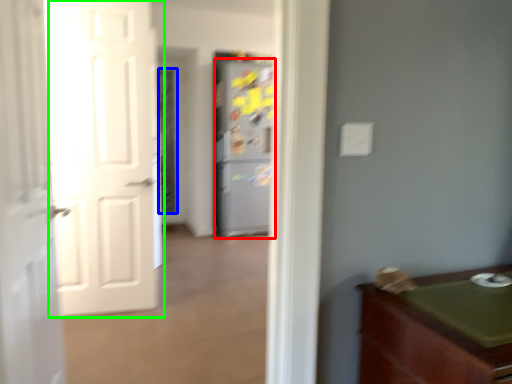
Question: Which object is the farthest from refrigerator (highlighted by a red box)? Choose among these: screen door (highlighted by a blue box) or door (highlighted by a green box).

Choices:
 (A) screen door
 (B) door

Answer: (B)